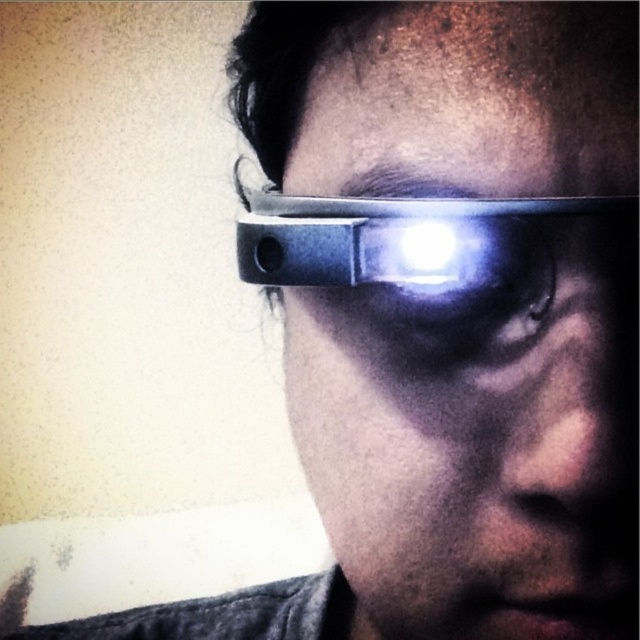
In the scene shown: You are trying to determine the vertical positioning of the objects in the image. Given that both the matte black glasses at center and the matte black headband at center are centered horizontally, which one appears higher up in the image?

The matte black glasses at center appears higher up in the image because it is much taller than the matte black headband at center.

From the picture: You are trying to determine the correct placement of accessories on a mannequin. You have a matte black glasses at center and a matte black headband at center. According to the image, which accessory should be placed to the right side of the other?

The matte black glasses at center should be placed to the right of the matte black headband at center according to the image.